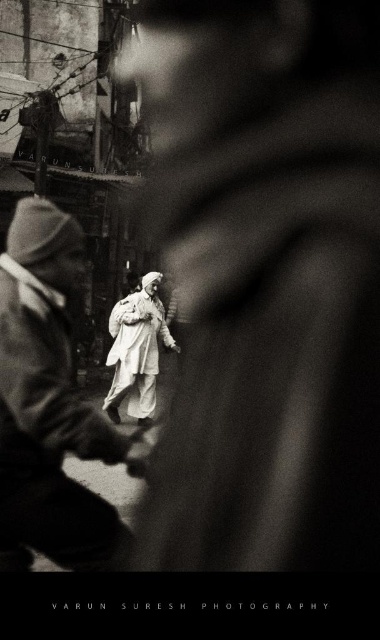
You are a fashion designer observing the street scene. You notice the matte gray coat at center and the white cotton dress at center. Which clothing item appears narrower in the image?

The matte gray coat at center has a lesser width compared to the white cotton dress at center, so the matte gray coat at center appears narrower.

You are a photographer planning to take a portrait of the central figure. The camera you are using has a depth of field that can only sharply focus on objects within 15 feet of each other. Given the distance between the matte gray coat at center and the white cotton dress at center, will both items be in focus simultaneously?

The distance between the matte gray coat at center and the white cotton dress at center is 19.81 feet. Since the camera can only focus on objects within 15 feet of each other, the two items are too far apart to be in focus simultaneously.